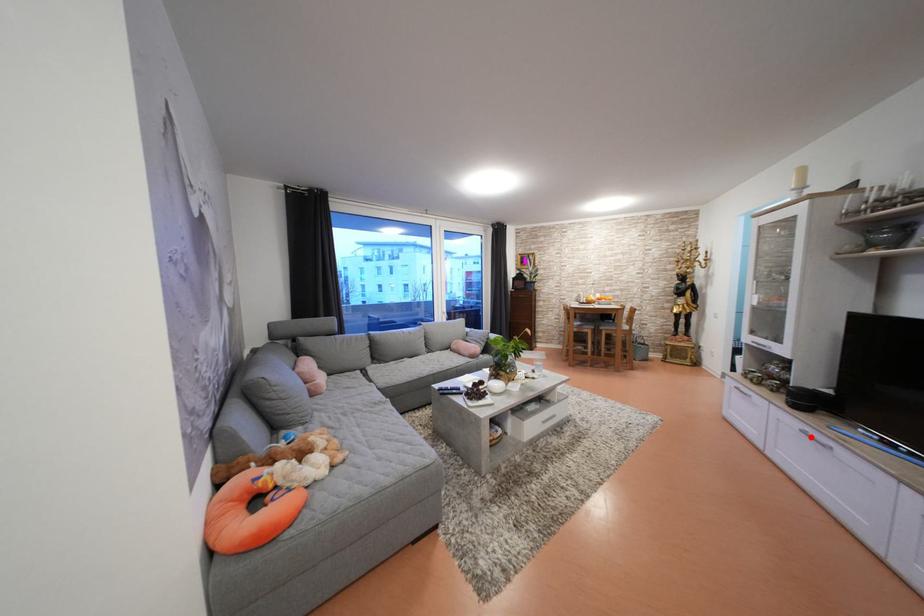
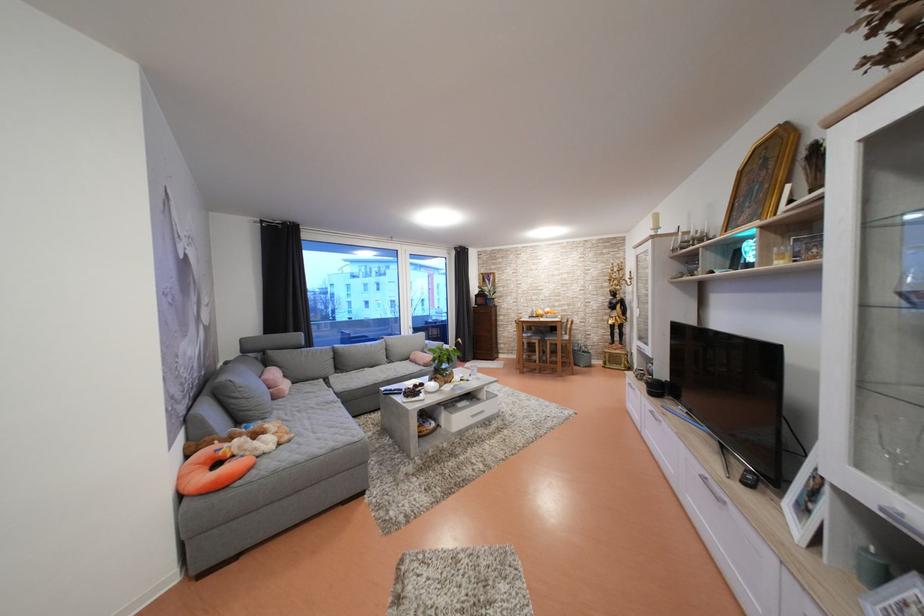
Question: I am providing you with two images of the same scene from different viewpoints. In image1, a red point is highlighted. Considering the same 3D point in image2, which of the following is correct?

Choices:
 (A) It is closer
 (B) It is farther

Answer: (A)